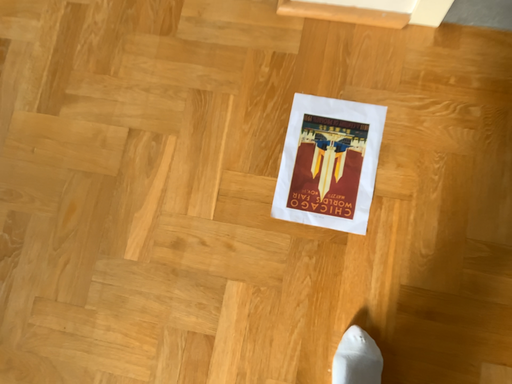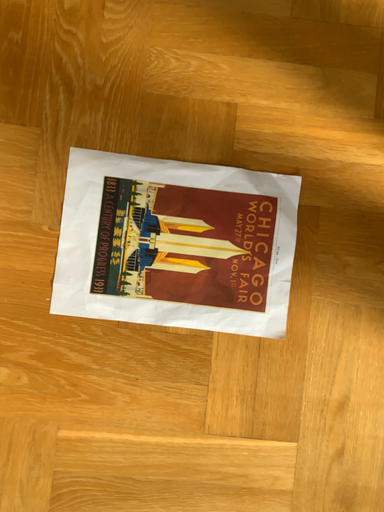
Question: How did the camera likely rotate when shooting the video?

Choices:
 (A) rotated downward
 (B) rotated upward

Answer: (B)